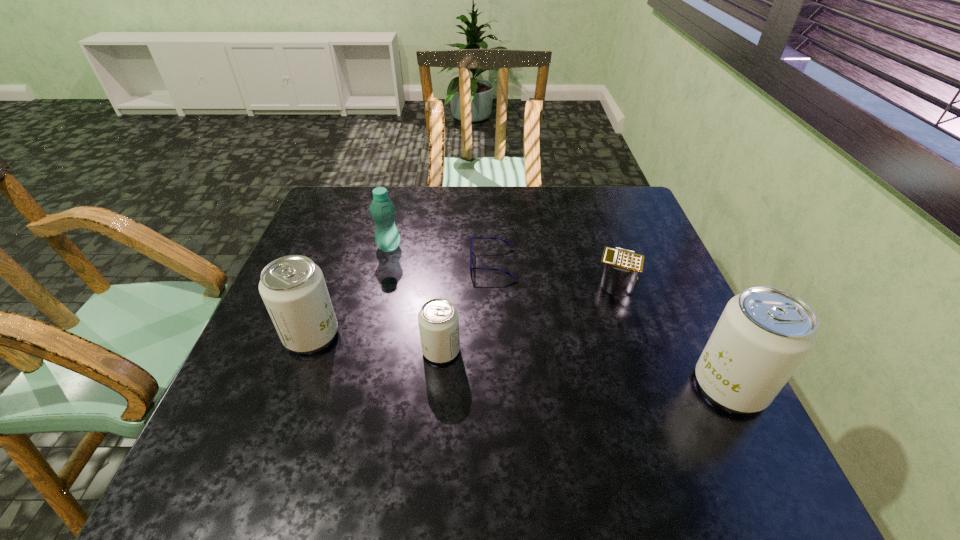
Where is `free spot located on the right of the leftmost object`? The height and width of the screenshot is (540, 960). free spot located on the right of the leftmost object is located at coordinates (425, 335).

At what (x,y) coordinates should I click in order to perform the action: click on free space located 0.100m on the right of the shortest soda can. Please return your answer as a coordinate pair (x, y). This screenshot has width=960, height=540. Looking at the image, I should click on (505, 350).

Identify the location of vacant region located 0.240m on the back of the rightmost object. (680, 284).

Where is `vacant space located on the front-facing side of the shortest object`? The height and width of the screenshot is (540, 960). vacant space located on the front-facing side of the shortest object is located at coordinates (383, 264).

Where is `vacant space located 0.050m on the front-facing side of the shortest object`? The height and width of the screenshot is (540, 960). vacant space located 0.050m on the front-facing side of the shortest object is located at coordinates (452, 264).

This screenshot has width=960, height=540. Find the location of `free space located on the front-facing side of the shortest object`. free space located on the front-facing side of the shortest object is located at coordinates (452, 264).

Where is `vacant region located at the front cap of the second object from left to right`? vacant region located at the front cap of the second object from left to right is located at coordinates (450, 247).

The height and width of the screenshot is (540, 960). I want to click on free spot located on the front of the fifth tallest object, so click(x=641, y=359).

The width and height of the screenshot is (960, 540). Identify the location of object that is at the near edge. (764, 333).

At what (x,y) coordinates should I click in order to perform the action: click on object at the left edge. Please return your answer as a coordinate pair (x, y). Image resolution: width=960 pixels, height=540 pixels. Looking at the image, I should click on (293, 289).